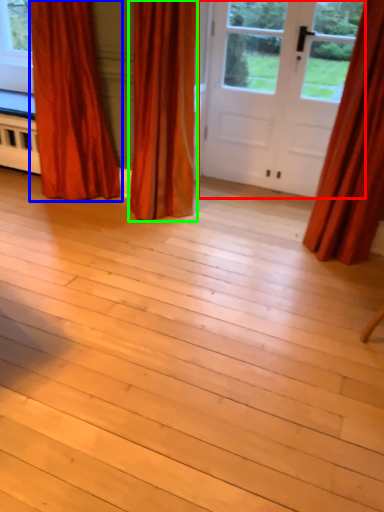
Question: Which is farther away from door (highlighted by a red box)? curtain (highlighted by a blue box) or curtain (highlighted by a green box)?

Choices:
 (A) curtain
 (B) curtain

Answer: (A)